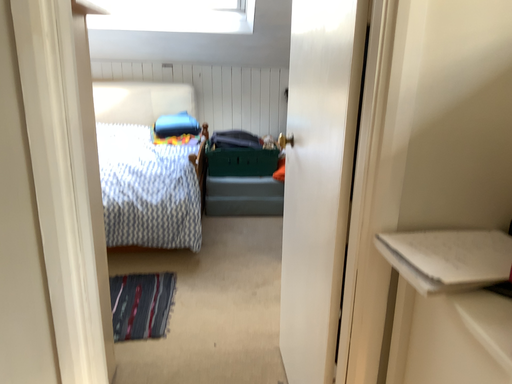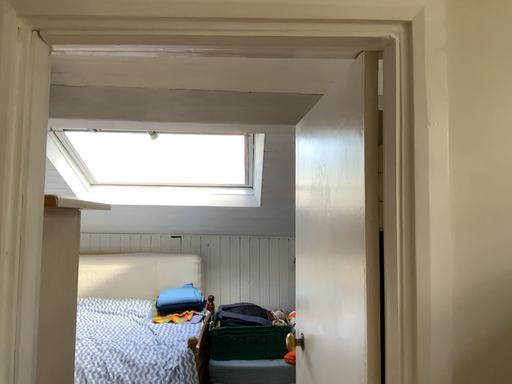
Question: Which way did the camera rotate in the video?

Choices:
 (A) rotated upward
 (B) rotated downward

Answer: (A)